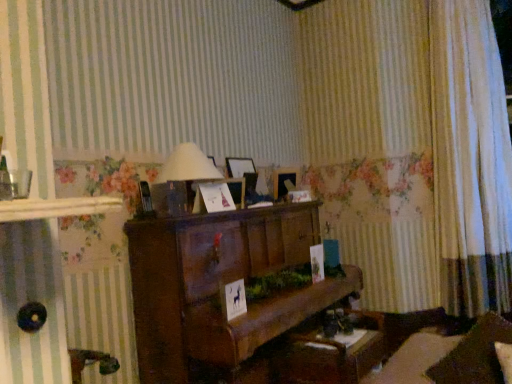
Question: Does wooden piano at center have a larger size compared to white sheer curtain at right?

Choices:
 (A) no
 (B) yes

Answer: (B)

Question: Are wooden piano at center and white sheer curtain at right making contact?

Choices:
 (A) no
 (B) yes

Answer: (A)

Question: From a real-world perspective, is wooden piano at center over white sheer curtain at right?

Choices:
 (A) no
 (B) yes

Answer: (A)

Question: Considering the relative positions of wooden piano at center and white sheer curtain at right in the image provided, is wooden piano at center to the right of white sheer curtain at right from the viewer's perspective?

Choices:
 (A) yes
 (B) no

Answer: (B)

Question: From a real-world perspective, is wooden piano at center beneath white sheer curtain at right?

Choices:
 (A) no
 (B) yes

Answer: (B)

Question: Does point (461, 208) appear closer or farther from the camera than point (300, 360)?

Choices:
 (A) farther
 (B) closer

Answer: (A)

Question: From their relative heights in the image, would you say white sheer curtain at right is taller or shorter than wooden table at lower center?

Choices:
 (A) tall
 (B) short

Answer: (A)

Question: Is white sheer curtain at right bigger or smaller than wooden table at lower center?

Choices:
 (A) big
 (B) small

Answer: (A)

Question: Considering the positions of white sheer curtain at right and wooden table at lower center in the image, is white sheer curtain at right wider or thinner than wooden table at lower center?

Choices:
 (A) thin
 (B) wide

Answer: (A)

Question: From their relative heights in the image, would you say wooden table at lower center is taller or shorter than wooden piano at center?

Choices:
 (A) short
 (B) tall

Answer: (A)

Question: From a real-world perspective, is wooden table at lower center physically located above or below wooden piano at center?

Choices:
 (A) above
 (B) below

Answer: (B)

Question: Is wooden table at lower center to the left or to the right of wooden piano at center in the image?

Choices:
 (A) left
 (B) right

Answer: (B)

Question: Is point (373, 329) closer or farther from the camera than point (242, 331)?

Choices:
 (A) closer
 (B) farther

Answer: (B)

Question: Based on their sizes in the image, would you say wooden piano at center is bigger or smaller than matte white lampshade at center?

Choices:
 (A) big
 (B) small

Answer: (A)

Question: Would you say wooden piano at center is inside or outside matte white lampshade at center?

Choices:
 (A) inside
 (B) outside

Answer: (B)